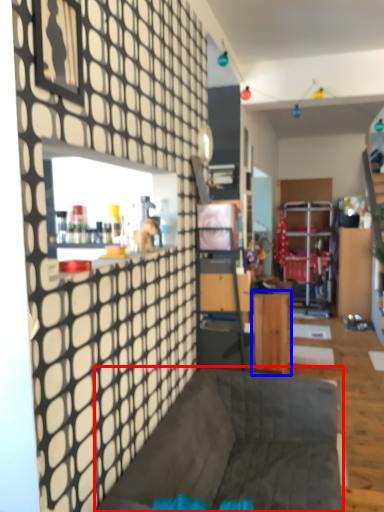
Question: Which object is further to the camera taking this photo, furniture (highlighted by a red box) or table (highlighted by a blue box)?

Choices:
 (A) furniture
 (B) table

Answer: (B)